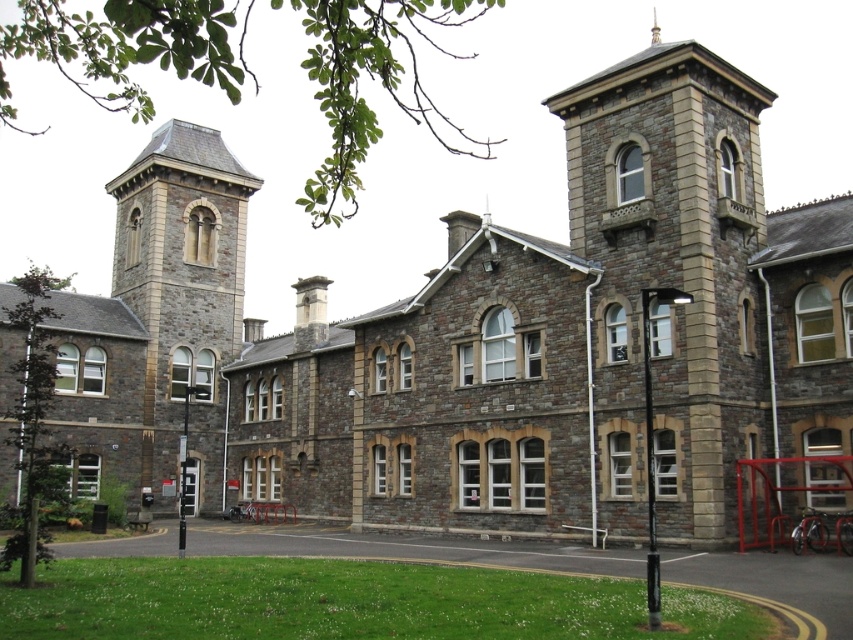
Does point (595, 106) come farther from viewer compared to point (149, 204)?

No, it is in front of (149, 204).

What do you see at coordinates (670, 275) in the screenshot? The height and width of the screenshot is (640, 853). I see `stone tower at center` at bounding box center [670, 275].

Locate an element on the screen. stone tower at center is located at coordinates (670, 275).